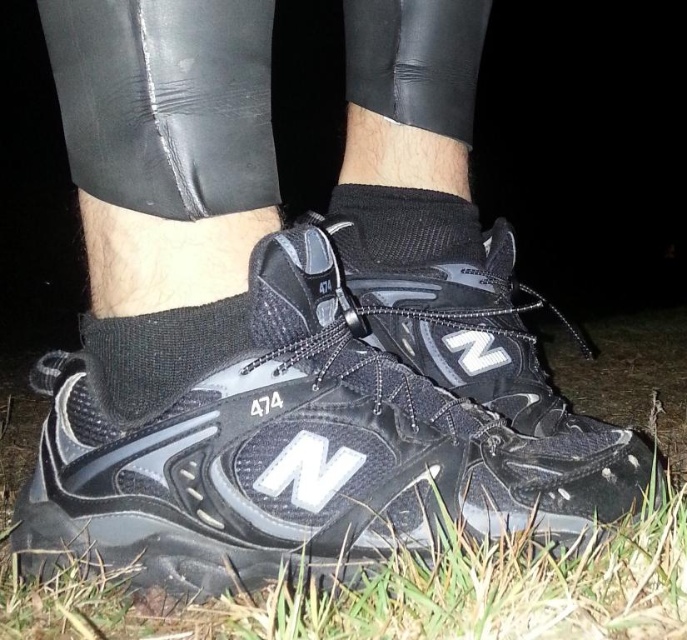
Question: Can you confirm if black mesh shoe at center is positioned below black mesh sock at center?

Choices:
 (A) no
 (B) yes

Answer: (B)

Question: Which is nearer to the black mesh sock at lower center?

Choices:
 (A) black mesh shoe at center
 (B) black mesh sock at center

Answer: (A)

Question: Among these points, which one is nearest to the camera?

Choices:
 (A) (313, 246)
 (B) (170, 388)
 (C) (436, 192)

Answer: (B)

Question: Among these objects, which one is nearest to the camera?

Choices:
 (A) black mesh shoe at center
 (B) black mesh sock at lower center

Answer: (A)

Question: Is black mesh sock at lower center closer to the viewer compared to black mesh sock at center?

Choices:
 (A) no
 (B) yes

Answer: (B)

Question: Can you confirm if black mesh shoe at center is thinner than black mesh sock at center?

Choices:
 (A) no
 (B) yes

Answer: (A)